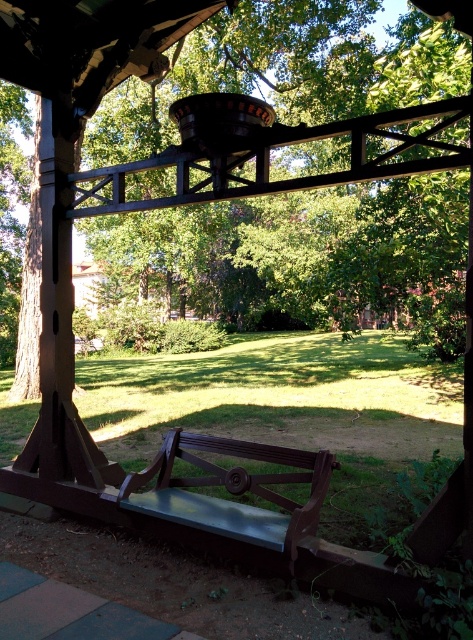
You are sitting on the metallic polished bench at center and looking towards the brown wood tree at upper left. Is the tree above or below your line of sight?

The brown wood tree at upper left is above the metallic polished bench at center, so when sitting on the bench, the tree would be above your line of sight.

You are planning to take a photo of the brown wood tree at upper left and the metallic polished bench at center from the gazebo. Which object should you focus on first if you want to capture both in the same frame without moving the camera?

The brown wood tree at upper left is taller than the metallic polished bench at center. To include both in the frame, focus on the brown wood tree at upper left first as it is taller and might require adjusting the camera angle to accommodate its height.